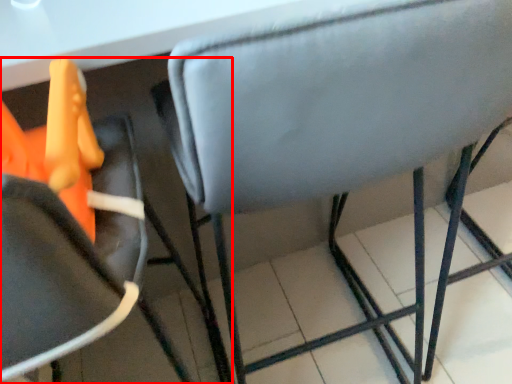
Question: From the image's perspective, what is the correct spatial positioning of chair (annotated by the red box) in reference to chair?

Choices:
 (A) below
 (B) above

Answer: (A)